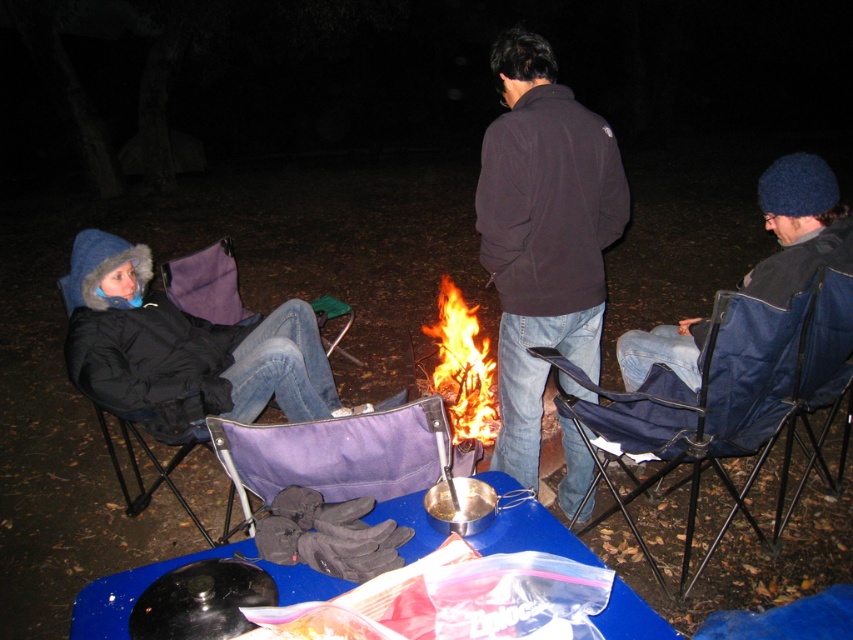
Based on the photo, is dark fleece jacket at center positioned in front of purple canvas chair at center?

That is False.

Is the position of dark fleece jacket at center more distant than that of purple canvas chair at center?

Yes, it is behind purple canvas chair at center.

Identify the location of dark fleece jacket at center. This screenshot has height=640, width=853. (543, 234).

Can you confirm if blue fabric chair at right is smaller than purple fabric chair at left?

Incorrect, blue fabric chair at right is not smaller in size than purple fabric chair at left.

Can you confirm if blue fabric chair at right is wider than purple fabric chair at left?

Correct, the width of blue fabric chair at right exceeds that of purple fabric chair at left.

Is point (727, 330) positioned before point (334, 310)?

Yes, point (727, 330) is closer to viewer.

At what (x,y) coordinates should I click in order to perform the action: click on blue fabric chair at right. Please return your answer as a coordinate pair (x, y). Image resolution: width=853 pixels, height=640 pixels. Looking at the image, I should click on (757, 374).

Between black fuzzy hat at left and blue fabric chair at center, which one appears on the left side from the viewer's perspective?

From the viewer's perspective, black fuzzy hat at left appears more on the left side.

Who is more distant from viewer, (219, 326) or (791, 368)?

Answer: The point (219, 326) is behind.

Does point (231, 333) come farther from viewer compared to point (589, 406)?

Yes, point (231, 333) is behind point (589, 406).

At what (x,y) coordinates should I click in order to perform the action: click on black fuzzy hat at left. Please return your answer as a coordinate pair (x, y). This screenshot has width=853, height=640. Looking at the image, I should click on (184, 349).